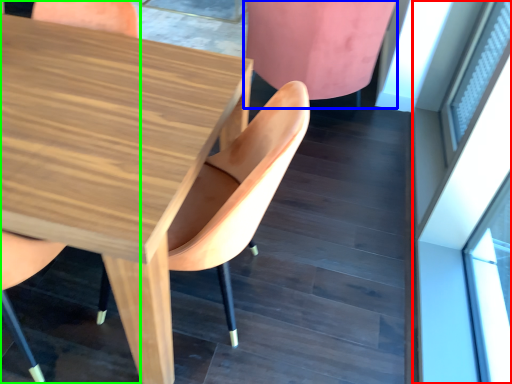
Question: Considering the real-world distances, which object is closest to glass door (highlighted by a red box)? chair (highlighted by a blue box) or chair (highlighted by a green box).

Choices:
 (A) chair
 (B) chair

Answer: (A)